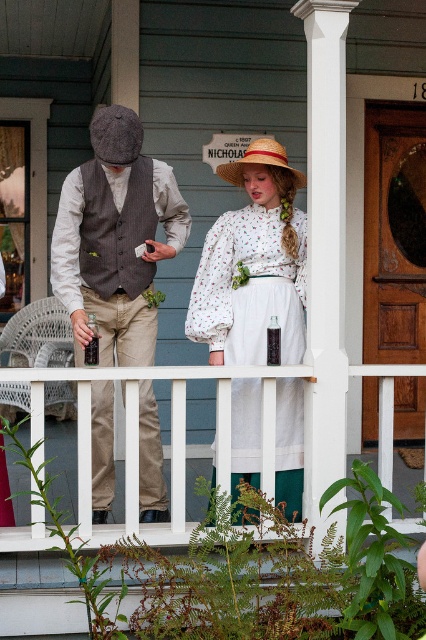
Question: Does matte brown vest at left appear under strawmaterial/texturehat at upper center?

Choices:
 (A) yes
 (B) no

Answer: (A)

Question: Is floral cotton blouse at center positioned at the back of white wooden railing at center?

Choices:
 (A) no
 (B) yes

Answer: (B)

Question: Estimate the real-world distances between objects in this image. Which object is closer to the white wooden railing at center?

Choices:
 (A) strawmaterial/texturehat at upper center
 (B) matte brown vest at left
 (C) floral cotton blouse at center

Answer: (C)

Question: Based on their relative distances, which object is farther from the strawmaterial/texturehat at upper center?

Choices:
 (A) white wooden railing at center
 (B) floral cotton blouse at center
 (C) matte brown vest at left

Answer: (A)

Question: Is matte brown vest at left thinner than white wooden railing at center?

Choices:
 (A) yes
 (B) no

Answer: (A)

Question: Which of the following is the closest to the observer?

Choices:
 (A) floral cotton blouse at center
 (B) matte brown vest at left
 (C) white wooden railing at center

Answer: (C)